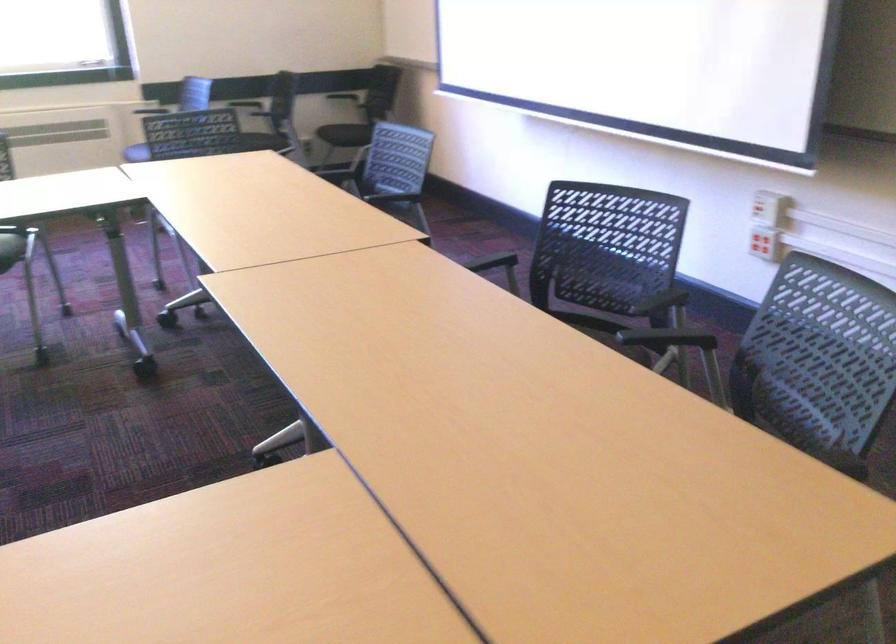
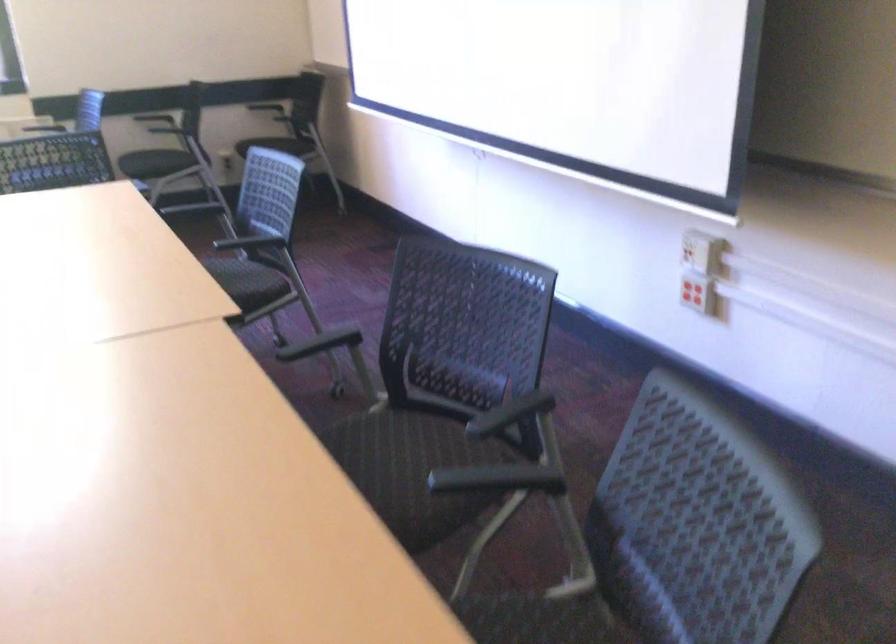
In a continuous first-person perspective shot, in which direction is the camera moving?

The cameraman moved toward right, forward.